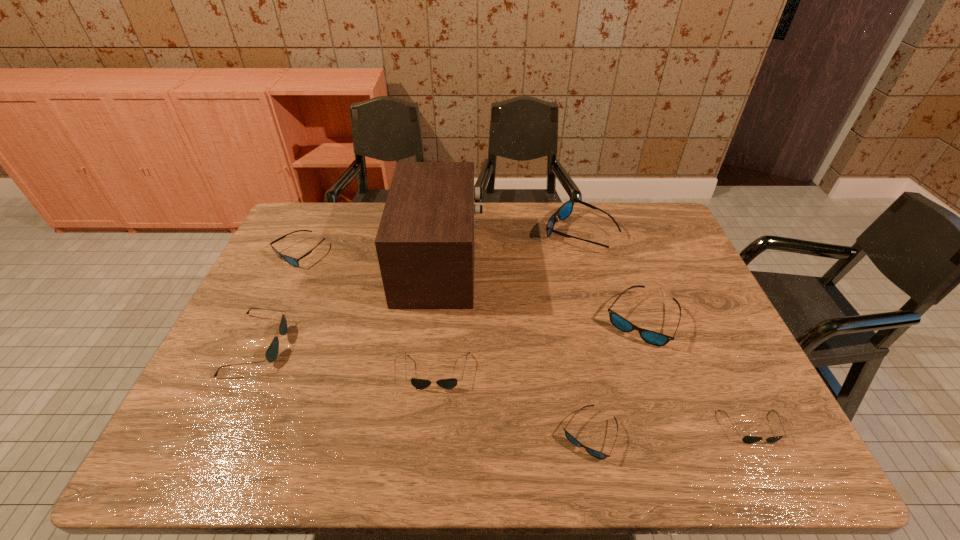
Identify the location of the smallest black sunglasses. (747, 439).

Where is `vacant space situated on the front-facing side of the tallest object`? vacant space situated on the front-facing side of the tallest object is located at coordinates (540, 262).

Identify the location of vacant region located 0.300m at the front of the tallest sunglasses showing the lenses. (455, 233).

This screenshot has width=960, height=540. Identify the location of vacant space located 0.080m at the front of the tallest sunglasses showing the lenses. (519, 233).

Locate an element on the screen. vacant space located 0.240m at the front of the tallest sunglasses showing the lenses is located at coordinates (472, 233).

Identify the location of vacant space located at the front of the second biggest blue sunglasses showing the lenses. (687, 452).

Find the location of `vacant region located 0.090m on the lenses of the biggest black sunglasses`. vacant region located 0.090m on the lenses of the biggest black sunglasses is located at coordinates (318, 345).

This screenshot has height=540, width=960. What are the coordinates of `free region located at the front of the second smallest blue sunglasses showing the lenses` in the screenshot? It's located at (246, 366).

Where is `vacant space located on the lenses of the second smallest black sunglasses`? The height and width of the screenshot is (540, 960). vacant space located on the lenses of the second smallest black sunglasses is located at coordinates (431, 434).

Locate an element on the screen. Image resolution: width=960 pixels, height=540 pixels. radio receiver present at the far edge is located at coordinates (425, 241).